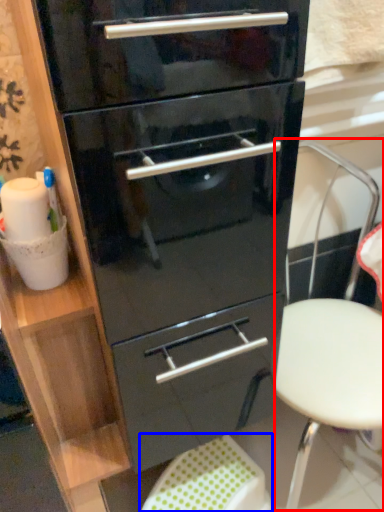
Question: Which point is further to the camera, folding chair (highlighted by a red box) or step stool (highlighted by a blue box)?

Choices:
 (A) folding chair
 (B) step stool

Answer: (B)